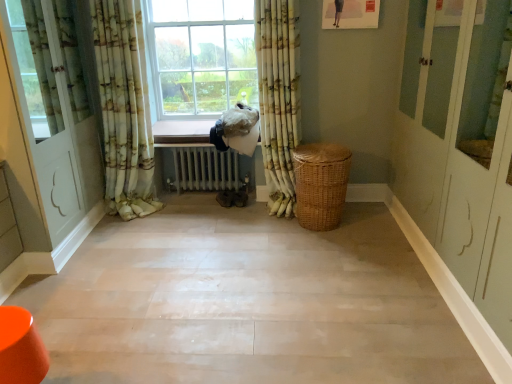
Where is `vacant space in front of floral fabric curtain at left, which ranks as the first curtain in left-to-right order`? This screenshot has height=384, width=512. vacant space in front of floral fabric curtain at left, which ranks as the first curtain in left-to-right order is located at coordinates (126, 238).